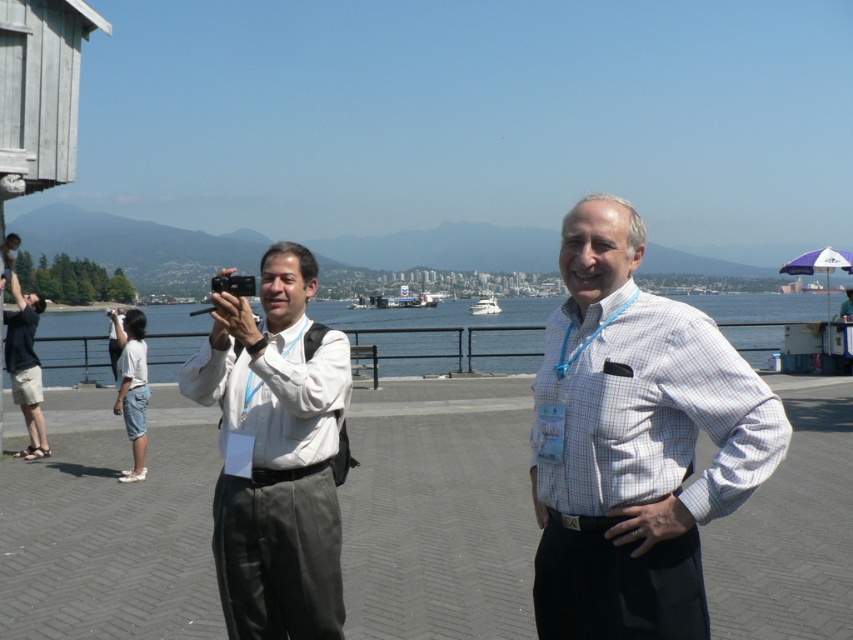
Question: Can you confirm if white checkered shirt at center is smaller than black plastic camera at center?

Choices:
 (A) no
 (B) yes

Answer: (B)

Question: Considering the relative positions of white matte shirt at center and black plastic camera at center in the image provided, where is white matte shirt at center located with respect to black plastic camera at center?

Choices:
 (A) right
 (B) left

Answer: (A)

Question: Which object appears closest to the camera in this image?

Choices:
 (A) matte black shirt at left
 (B) clear blue water at center
 (C) white matte shirt at center
 (D) white glossy boat at center

Answer: (C)

Question: Can you confirm if clear blue water at center is smaller than white denim shorts at lower left?

Choices:
 (A) no
 (B) yes

Answer: (A)

Question: Among these points, which one is farthest from the camera?

Choices:
 (A) (253, 305)
 (B) (24, 323)

Answer: (A)

Question: Among these objects, which one is nearest to the camera?

Choices:
 (A) white denim shorts at lower left
 (B) black plastic camera at center
 (C) white glossy boat at center
 (D) matte black shirt at left

Answer: (B)